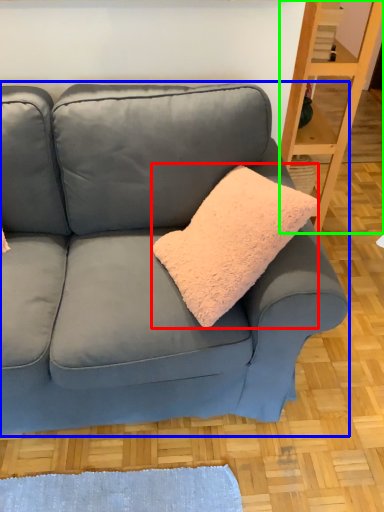
Question: Based on their relative distances, which object is farther from throw pillow (highlighted by a red box)? Choose from studio couch (highlighted by a blue box) and shelf (highlighted by a green box).

Choices:
 (A) studio couch
 (B) shelf

Answer: (B)